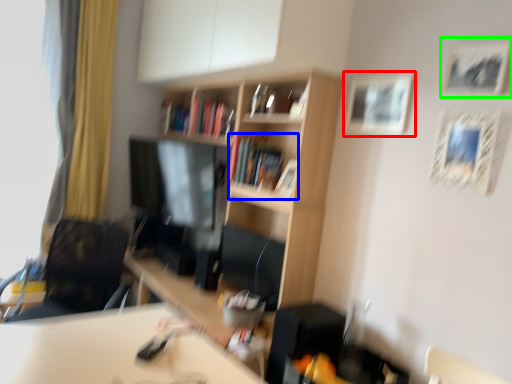
Question: Estimate the real-world distances between objects in this image. Which object is closer to picture frame (highlighted by a red box), book (highlighted by a blue box) or picture frame (highlighted by a green box)?

Choices:
 (A) book
 (B) picture frame

Answer: (B)